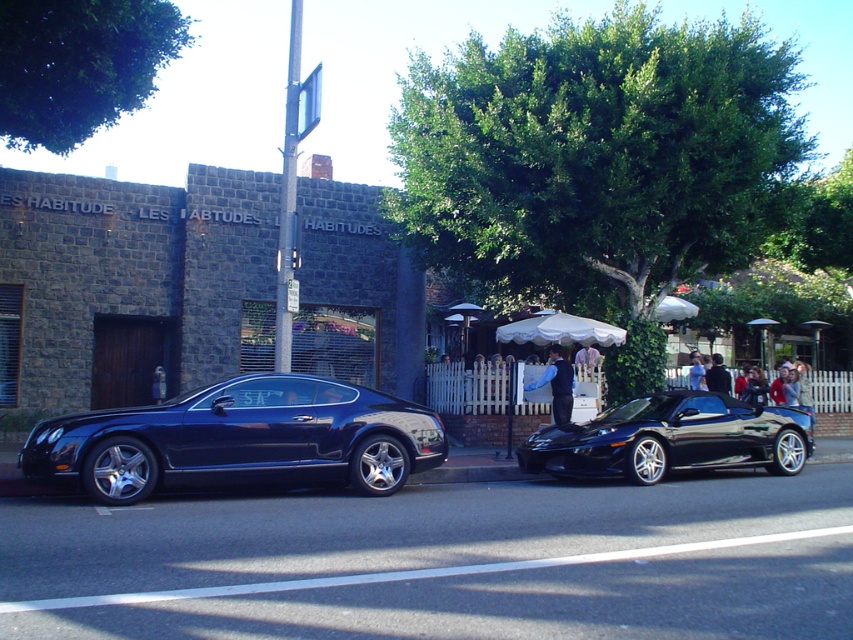
You are a delivery person who needs to place a 1.2 meter long package between the dark blue leather jacket at center and the light brown leather jacket at center. Can you fit the package between them without bending it?

The distance between the dark blue leather jacket at center and the light brown leather jacket at center is 1.54 meters. Since the package is 1.2 meters long, it can fit between them as the space is wider than the package.

You are a delivery person needing to place a light brown leather jacket at center into a black metallic sports car at right. Can the jacket fit inside the car based on their sizes?

The black metallic sports car at right is larger in size than the light brown leather jacket at center, so the jacket should fit inside the car without any issues.